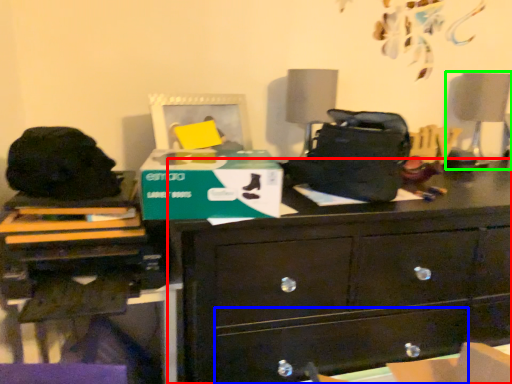
Question: Which object is positioned farthest from chest of drawers (highlighted by a red box)? Select from drawer (highlighted by a blue box) and swivel chair (highlighted by a green box).

Choices:
 (A) drawer
 (B) swivel chair

Answer: (B)